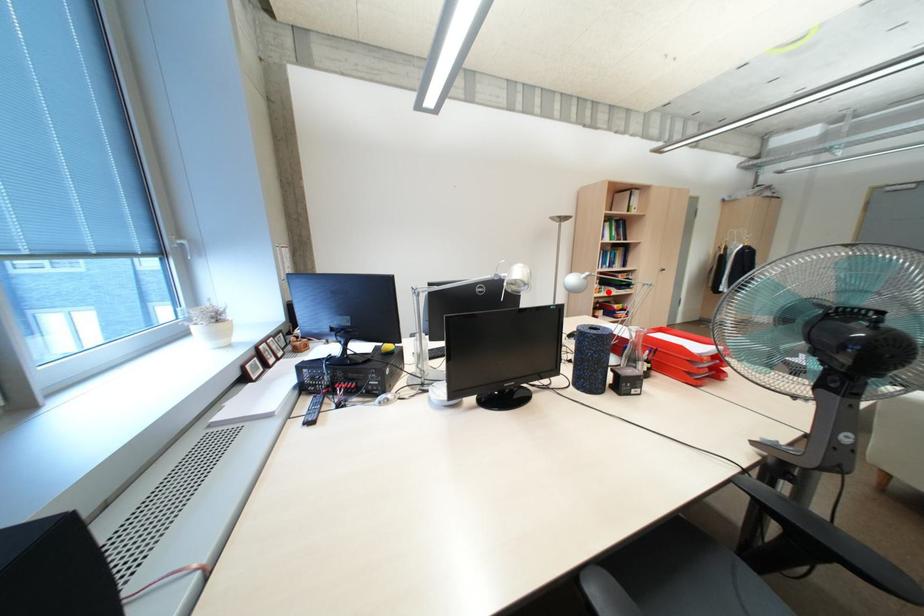
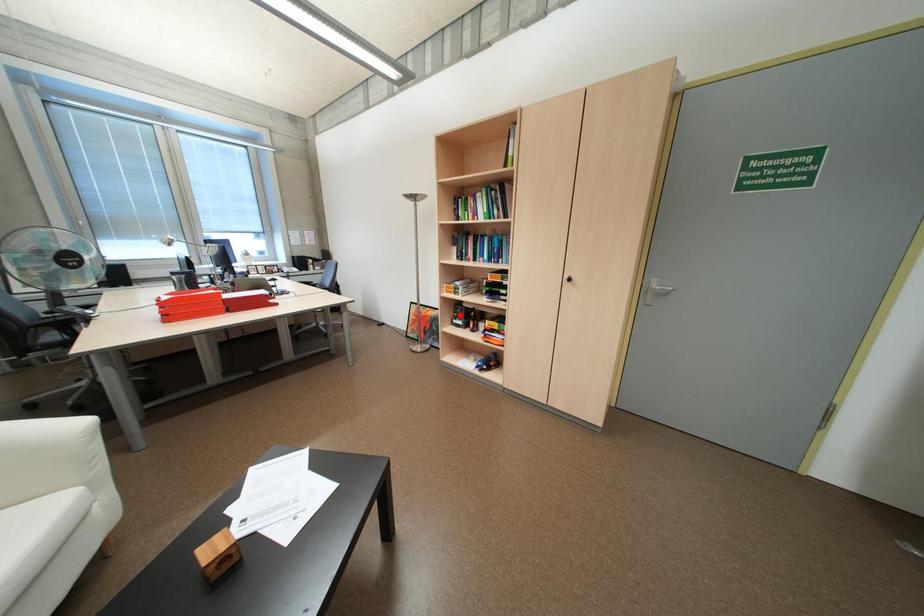
I am providing you with two images of the same scene from different viewpoints. A red point is marked on the first image and another point is marked on the second image. Is the marked point in image1 the same physical position as the marked point in image2?

No